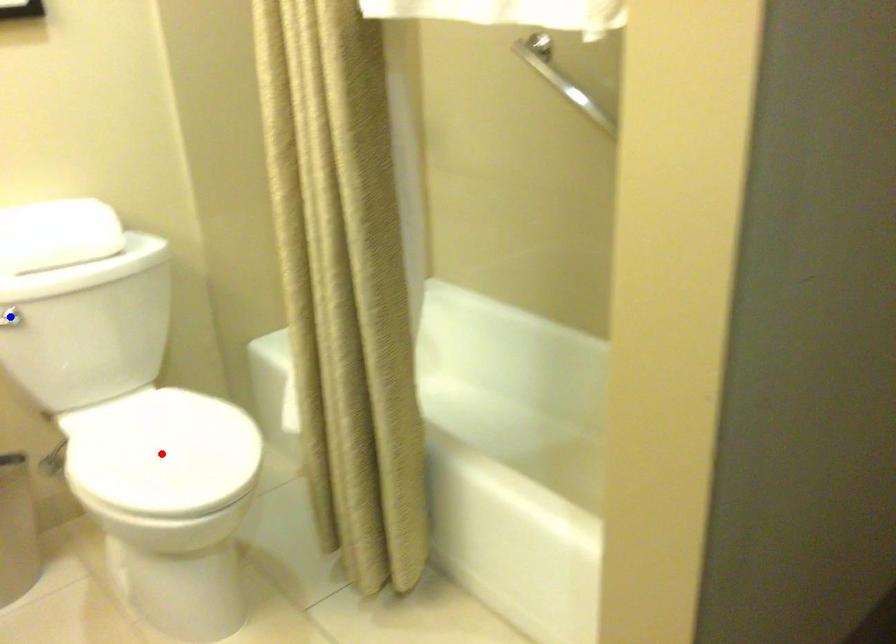
Question: In the image, two points are highlighted. Which point is nearer to the camera? Reply with the corresponding letter.

Choices:
 (A) blue point
 (B) red point

Answer: (A)